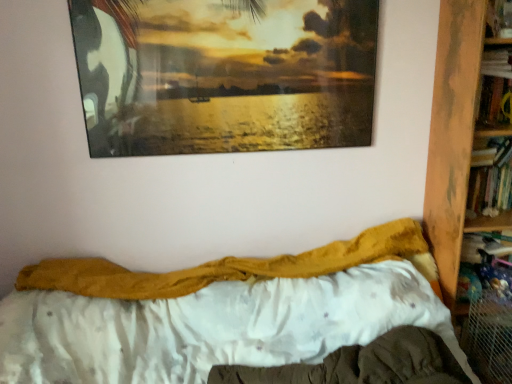
Question: From the image's perspective, is wooden bookcase at right on top of mustard yellow fabric at center?

Choices:
 (A) no
 (B) yes

Answer: (B)

Question: Can you confirm if wooden bookcase at right is smaller than mustard yellow fabric at center?

Choices:
 (A) yes
 (B) no

Answer: (B)

Question: Is wooden bookcase at right to the right of mustard yellow fabric at center from the viewer's perspective?

Choices:
 (A) no
 (B) yes

Answer: (B)

Question: Would you say wooden bookcase at right is a long distance from mustard yellow fabric at center?

Choices:
 (A) no
 (B) yes

Answer: (A)

Question: Is wooden bookcase at right next to mustard yellow fabric at center?

Choices:
 (A) yes
 (B) no

Answer: (B)

Question: From a real-world perspective, is white satin mattress at lower center above or below wooden bookcase at right?

Choices:
 (A) below
 (B) above

Answer: (A)

Question: Is white satin mattress at lower center in front of or behind wooden bookcase at right in the image?

Choices:
 (A) front
 (B) behind

Answer: (A)

Question: From the image's perspective, relative to wooden bookcase at right, is white satin mattress at lower center above or below?

Choices:
 (A) below
 (B) above

Answer: (A)

Question: Considering the positions of point (352, 372) and point (448, 125), is point (352, 372) closer or farther from the camera than point (448, 125)?

Choices:
 (A) farther
 (B) closer

Answer: (B)

Question: Looking at their shapes, would you say metallic glossy picture frame at upper center is wider or thinner than white satin mattress at lower center?

Choices:
 (A) wide
 (B) thin

Answer: (B)

Question: Considering the positions of point (223, 94) and point (416, 337), is point (223, 94) closer or farther from the camera than point (416, 337)?

Choices:
 (A) farther
 (B) closer

Answer: (A)

Question: In the image, is metallic glossy picture frame at upper center on the left side or the right side of white satin mattress at lower center?

Choices:
 (A) left
 (B) right

Answer: (A)

Question: Is metallic glossy picture frame at upper center inside or outside of white satin mattress at lower center?

Choices:
 (A) inside
 (B) outside

Answer: (B)

Question: From a real-world perspective, is fuzzy yellow blanket at center above or below mustard yellow fabric at center?

Choices:
 (A) above
 (B) below

Answer: (B)

Question: In terms of size, does fuzzy yellow blanket at center appear bigger or smaller than mustard yellow fabric at center?

Choices:
 (A) small
 (B) big

Answer: (B)